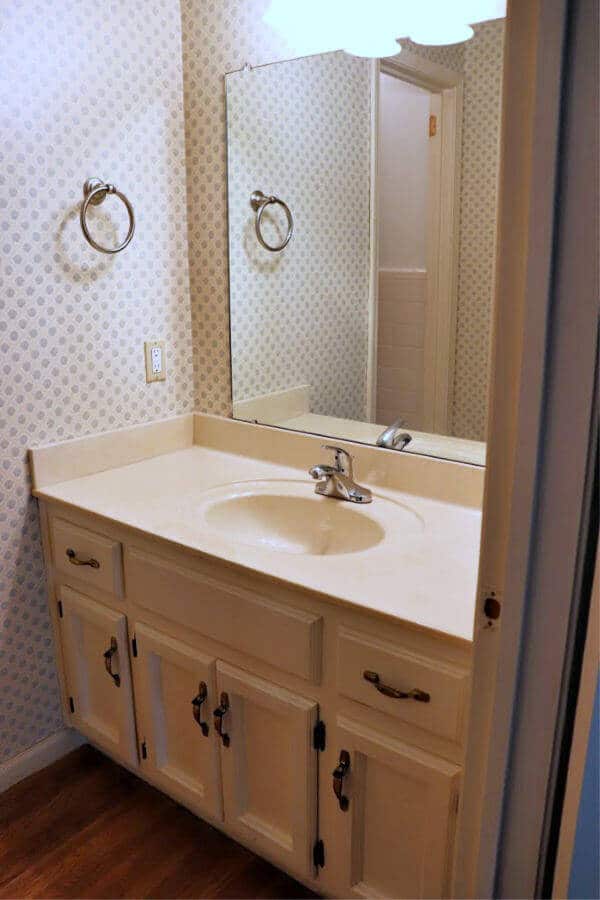
This screenshot has height=900, width=600. I want to click on white baseboard, so click(x=56, y=745).